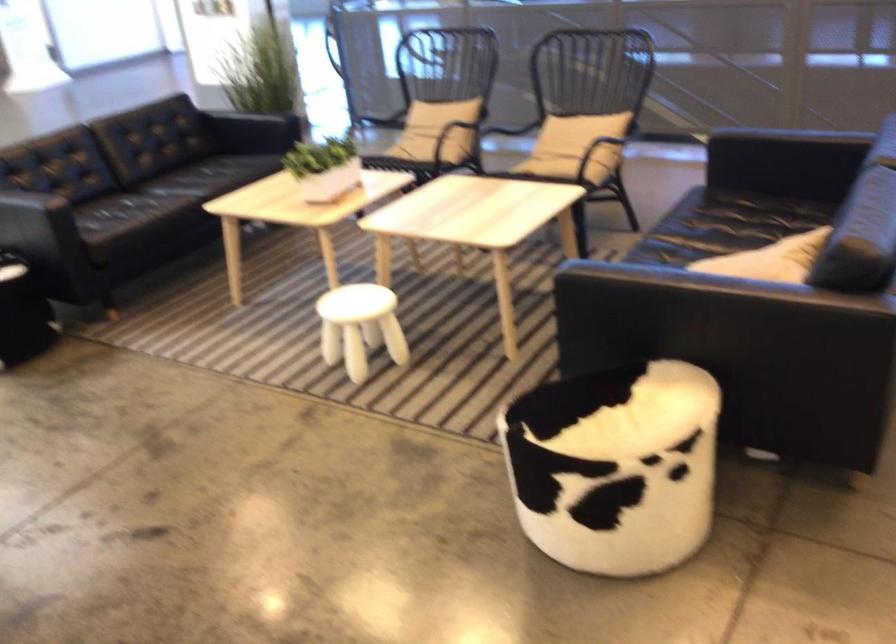
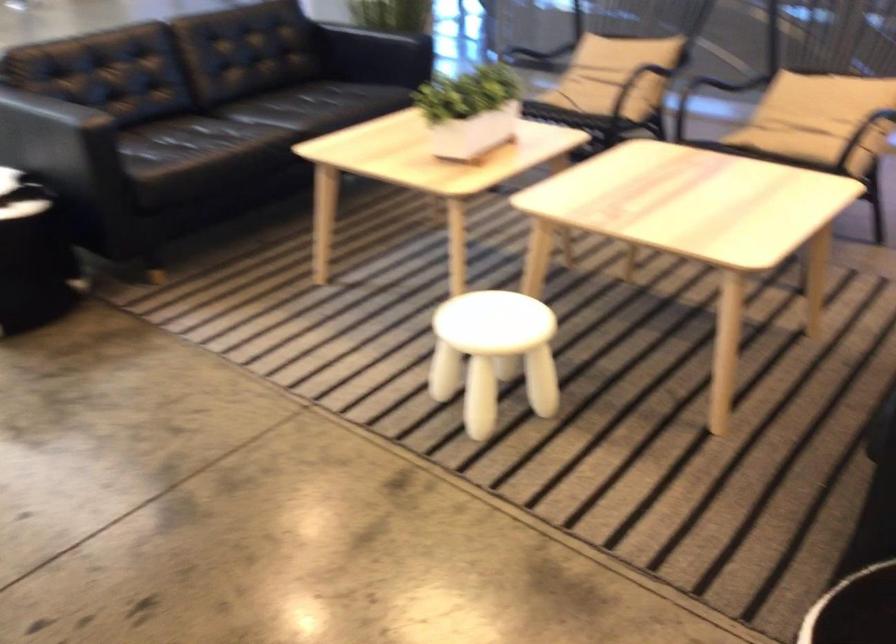
The point at (415, 140) is marked in the first image. Where is the corresponding point in the second image?

(597, 91)